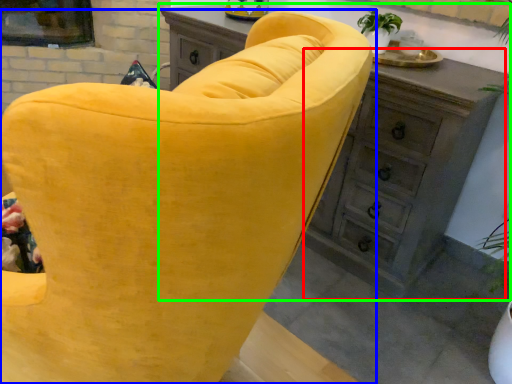
Question: Which object is the farthest from dresser (highlighted by a red box)? Choose among these: chair (highlighted by a blue box) or chest of drawers (highlighted by a green box).

Choices:
 (A) chair
 (B) chest of drawers

Answer: (A)